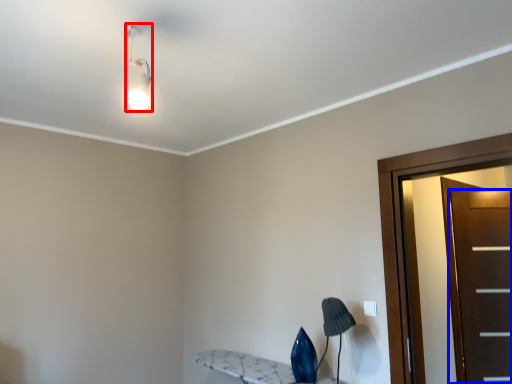
Question: Which of the following is the farthest to the observer, light fixture (highlighted by a red box) or door (highlighted by a blue box)?

Choices:
 (A) light fixture
 (B) door

Answer: (B)